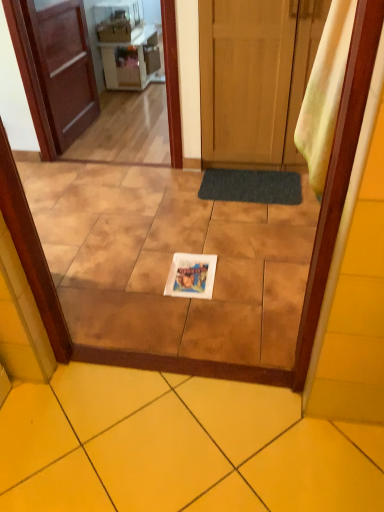
The width and height of the screenshot is (384, 512). Identify the location of unoccupied area behind white glossy book at center. (192, 246).